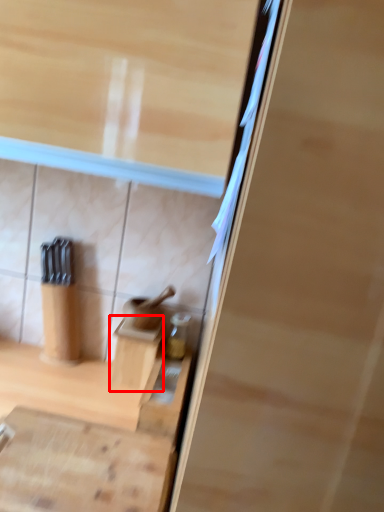
Question: Observing the image, what is the correct spatial positioning of cabinetry (annotated by the red box) in reference to cabinetry?

Choices:
 (A) left
 (B) right

Answer: (B)